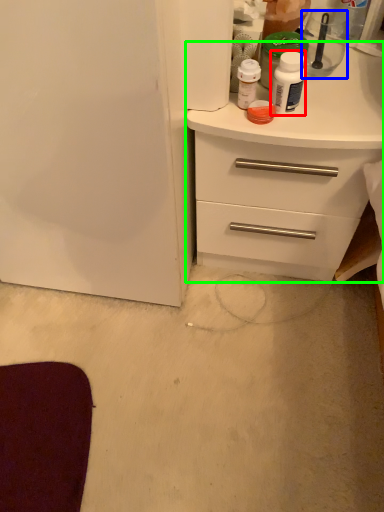
Question: Which object is the closest to the bottle (highlighted by a red box)? Choose among these: appliance (highlighted by a blue box) or chest of drawers (highlighted by a green box).

Choices:
 (A) appliance
 (B) chest of drawers

Answer: (B)